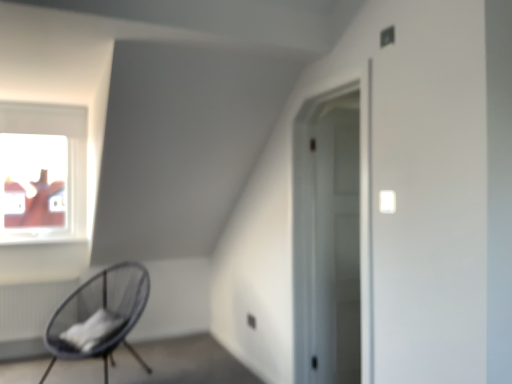
Image resolution: width=512 pixels, height=384 pixels. I want to click on free point below black mesh chair at lower left (from a real-world perspective), so click(110, 370).